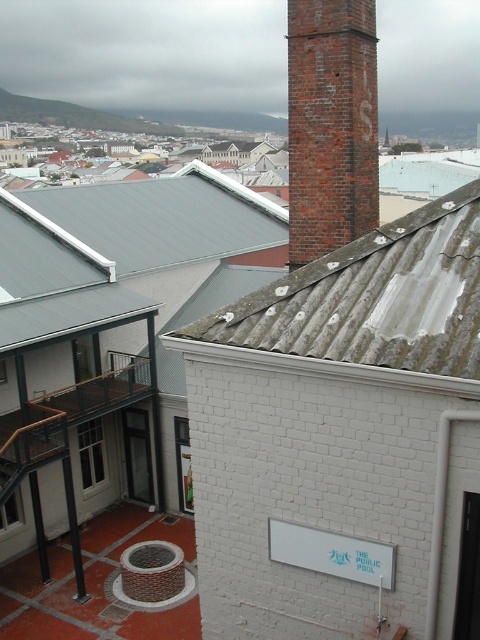
Can you confirm if weathered metal roof at center is thinner than metallic gray roof at upper left?

Yes.

Between point (402, 268) and point (181, 216), which one is positioned in front?

Point (402, 268)

You are a GUI agent. You are given a task and a screenshot of the screen. Output one action in this format:
    pyautogui.click(x=<x>, y=<y>)
    Task: Click on the weathered metal roof at center
    The image size is (480, 640).
    Given the screenshot: What is the action you would take?
    372,300

What do you see at coordinates (372, 300) in the screenshot? I see `weathered metal roof at center` at bounding box center [372, 300].

Between weathered metal roof at center and brick chimney at upper center, which one has less height?

weathered metal roof at center is shorter.

This screenshot has height=640, width=480. In order to click on weathered metal roof at center in this screenshot , I will do `click(372, 300)`.

Who is more forward, (x=296, y=227) or (x=84, y=193)?

Positioned in front is point (x=296, y=227).

Image resolution: width=480 pixels, height=640 pixels. Identify the location of brick chimney at upper center. (331, 124).

You are a GUI agent. You are given a task and a screenshot of the screen. Output one action in this format:
    pyautogui.click(x=<x>, y=<y>)
    Task: Click on the brick chimney at upper center
    The height and width of the screenshot is (640, 480).
    Given the screenshot: What is the action you would take?
    pyautogui.click(x=331, y=124)